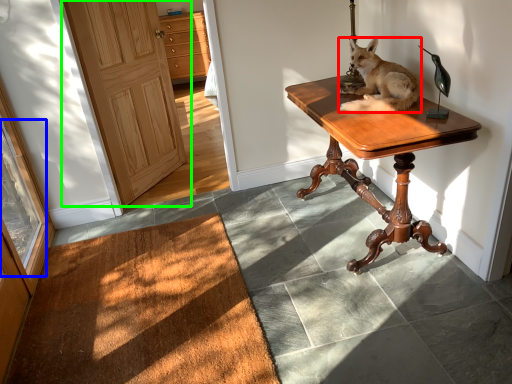
Question: Which object is positioned farthest from dog (highlighted by a red box)? Select from glass door (highlighted by a blue box) and door (highlighted by a green box).

Choices:
 (A) glass door
 (B) door

Answer: (A)